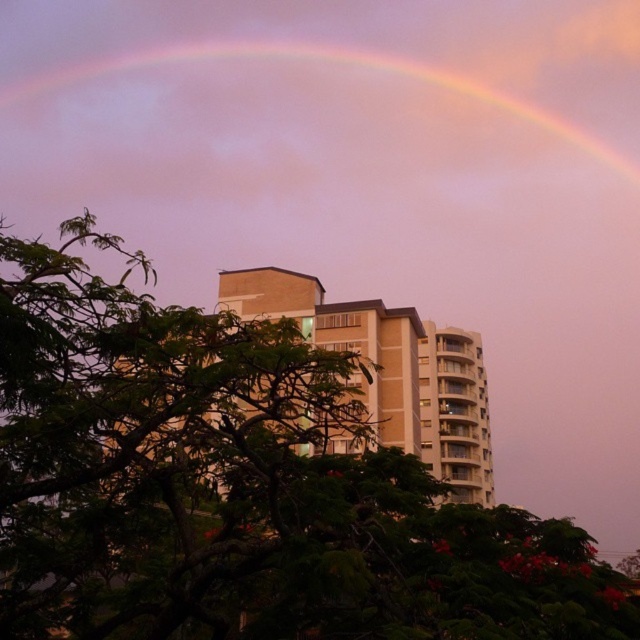
Question: Does green leafy tree at center appear on the left side of rainbow at upper center?

Choices:
 (A) yes
 (B) no

Answer: (B)

Question: Which point is closer to the camera?

Choices:
 (A) (74, 77)
 (B) (3, 340)

Answer: (B)

Question: Can you confirm if green leafy tree at center is positioned to the right of rainbow at upper center?

Choices:
 (A) no
 (B) yes

Answer: (B)

Question: Which object is closer to the camera taking this photo?

Choices:
 (A) green leafy tree at center
 (B) rainbow at upper center

Answer: (A)

Question: Which point is farther to the camera?

Choices:
 (A) (477, 84)
 (B) (156, 429)

Answer: (A)

Question: Is green leafy tree at center smaller than rainbow at upper center?

Choices:
 (A) yes
 (B) no

Answer: (A)